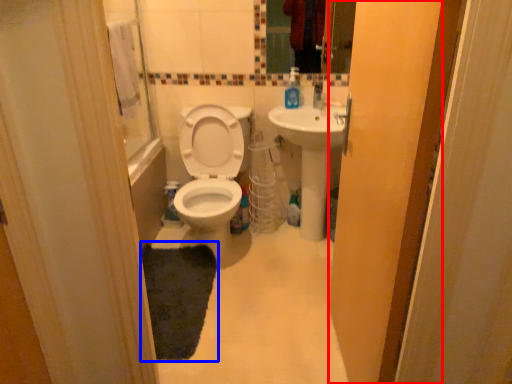
Question: Which of the following is the closest to the observer, screen door (highlighted by a red box) or mat (highlighted by a blue box)?

Choices:
 (A) screen door
 (B) mat

Answer: (A)